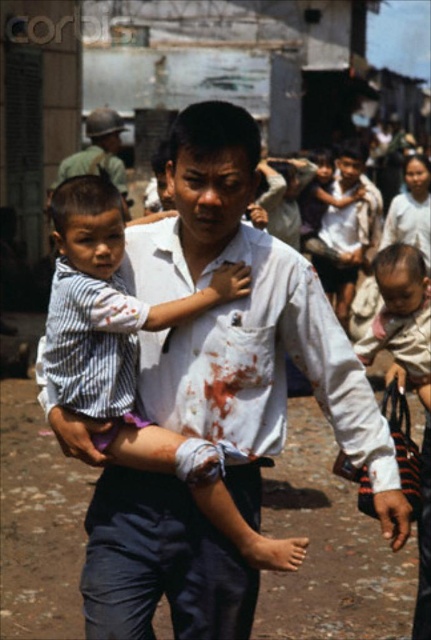
Question: Does striped cotton shirt at center lie in front of metallic helmet at upper left?

Choices:
 (A) yes
 (B) no

Answer: (A)

Question: Is striped cotton shirt at center behind metallic helmet at upper left?

Choices:
 (A) no
 (B) yes

Answer: (A)

Question: From the image, what is the correct spatial relationship of striped cotton shirt at center in relation to metallic helmet at upper left?

Choices:
 (A) left
 (B) right

Answer: (B)